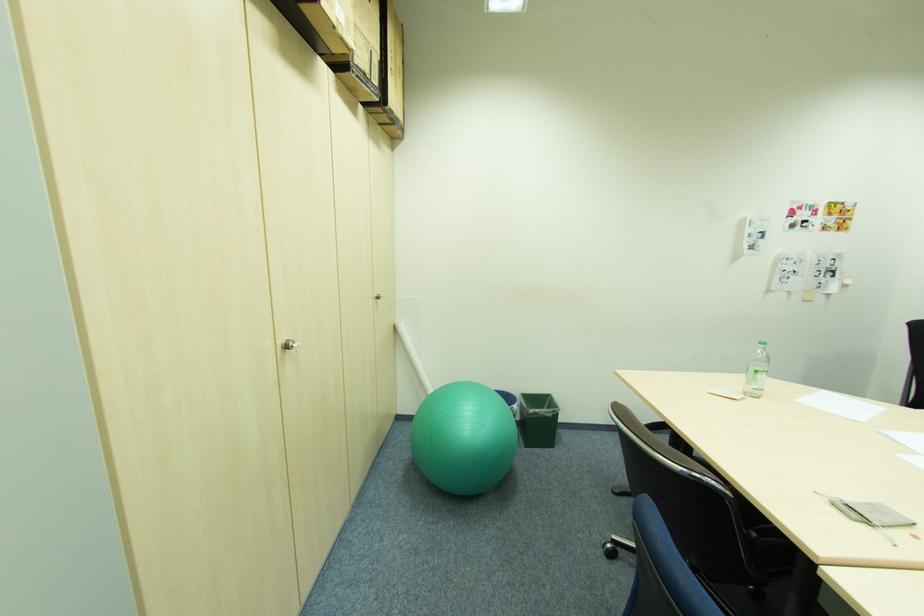
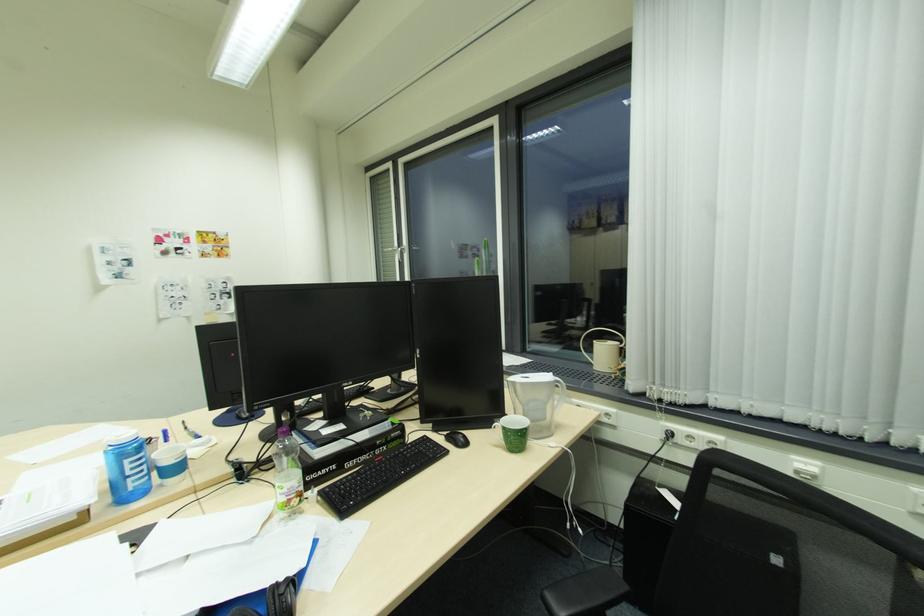
Where in the second image is the point corresponding to pixel 766 235 from the first image?

(131, 262)